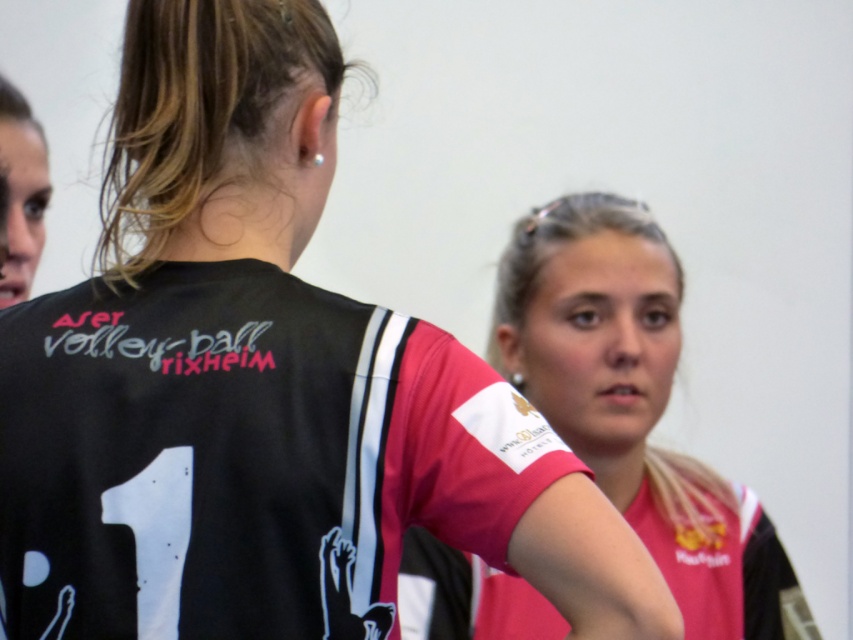
You are a photographer at a volleyball match. You need to capture a photo where both the black jersey at center and the pink jersey at center are visible. Based on their positions, which jersey should you focus on first to ensure both are in frame?

The black jersey at center is located above the pink jersey at center, so focusing on the black jersey at center first will ensure both are in frame as the pink jersey at center is below it.

You are observing a volleyball match and notice two players in the foreground. The player on the left is wearing a black jersey with white and light blue accents, and the player on the right is wearing a red and white jersey. According to the image, where is the black jersey at center positioned relative to the other objects in the scene?

The black jersey at center is located at point coordinates (x=242, y=456), which places it centrally within the image frame.

You are a photographer setting up a camera to capture both the black jersey at center and the pink jersey at center in the same frame. Which jersey should you adjust your camera angle to focus on first to ensure both are in frame, considering their sizes?

The black jersey at center is wider than the pink jersey at center, so you should focus on the black jersey at center first to ensure both fit within the camera frame.